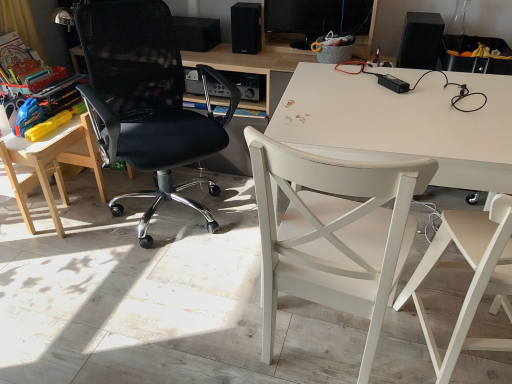
Question: Which direction should I rotate to face white wood chair at center, the second chair positioned from the right, — up or down?

Choices:
 (A) down
 (B) up

Answer: (A)

Question: Can you confirm if black matte speaker at upper center, which appears as the 3th loudspeaker when viewed from the right, is smaller than white wood chair at center, the second chair positioned from the right?

Choices:
 (A) yes
 (B) no

Answer: (A)

Question: Can you confirm if black matte speaker at upper center, arranged as the first loudspeaker when viewed from the left, is bigger than white wood chair at center, the second chair positioned from the right?

Choices:
 (A) no
 (B) yes

Answer: (A)

Question: Does black matte speaker at upper center, arranged as the first loudspeaker when viewed from the left, have a lesser height compared to white wood chair at center, the 3th chair viewed from the left?

Choices:
 (A) yes
 (B) no

Answer: (A)

Question: Considering the relative sizes of black matte speaker at upper center, arranged as the first loudspeaker when viewed from the left, and white wood chair at center, the 3th chair viewed from the left, in the image provided, is black matte speaker at upper center, arranged as the first loudspeaker when viewed from the left, thinner than white wood chair at center, the 3th chair viewed from the left,?

Choices:
 (A) yes
 (B) no

Answer: (A)

Question: Could you tell me if black matte speaker at upper center, arranged as the first loudspeaker when viewed from the left, is facing white wood chair at center, the second chair positioned from the right?

Choices:
 (A) yes
 (B) no

Answer: (B)

Question: From a real-world perspective, is black matte speaker at upper center, which appears as the 3th loudspeaker when viewed from the right, below white wood chair at center, the 3th chair viewed from the left?

Choices:
 (A) no
 (B) yes

Answer: (A)

Question: Can you confirm if white wood chair at right, placed as the 4th chair when sorted from left to right, is bigger than wooden table at left?

Choices:
 (A) yes
 (B) no

Answer: (A)

Question: Is white wood chair at right, which appears as the first chair when viewed from the right, to the left of wooden table at left from the viewer's perspective?

Choices:
 (A) yes
 (B) no

Answer: (B)

Question: Is white wood chair at right, which appears as the first chair when viewed from the right, looking in the opposite direction of wooden table at left?

Choices:
 (A) no
 (B) yes

Answer: (A)

Question: Is white wood chair at right, placed as the 4th chair when sorted from left to right, not within wooden table at left?

Choices:
 (A) no
 (B) yes

Answer: (B)

Question: Can wooden table at left be found inside white wood chair at right, placed as the 4th chair when sorted from left to right?

Choices:
 (A) yes
 (B) no

Answer: (B)

Question: Does black matte speaker at upper center, arranged as the first loudspeaker when viewed from the left, have a lesser width compared to wooden table at left?

Choices:
 (A) no
 (B) yes

Answer: (B)